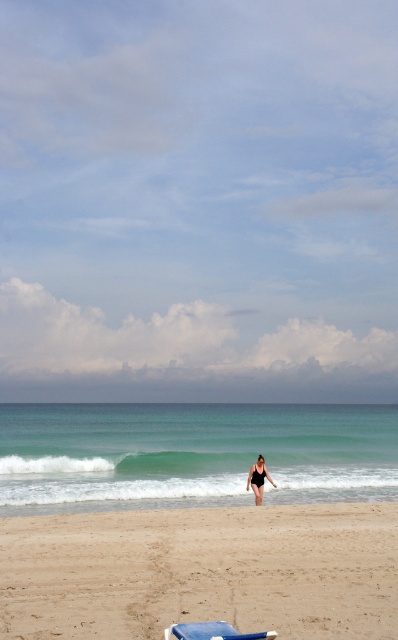
Between beige sandy beach at center and black matte swimsuit at center, which one has more height?

beige sandy beach at center is taller.

Is beige sandy beach at center below black matte swimsuit at center?

No, beige sandy beach at center is not below black matte swimsuit at center.

Does point (161, 540) come in front of point (247, 483)?

Yes.

Where is `beige sandy beach at center`? The height and width of the screenshot is (640, 398). beige sandy beach at center is located at coordinates (202, 572).

Image resolution: width=398 pixels, height=640 pixels. Describe the element at coordinates (212, 632) in the screenshot. I see `blue plastic beach chair at lower center` at that location.

Does point (189, 625) come in front of point (263, 468)?

Yes.

Which is in front, point (226, 621) or point (257, 481)?

Point (226, 621) is in front.

Where is `blue plastic beach chair at lower center`? This screenshot has width=398, height=640. blue plastic beach chair at lower center is located at coordinates (212, 632).

Consider the image. Which is more to the left, beige sandy beach at center or blue plastic beach chair at lower center?

blue plastic beach chair at lower center

Which is behind, point (183, 589) or point (200, 632)?

The point (183, 589) is behind.

Who is more distant from viewer, [120,586] or [195,627]?

Positioned behind is point [120,586].

At what (x,y) coordinates should I click in order to perform the action: click on beige sandy beach at center. Please return your answer as a coordinate pair (x, y). Looking at the image, I should click on (202, 572).